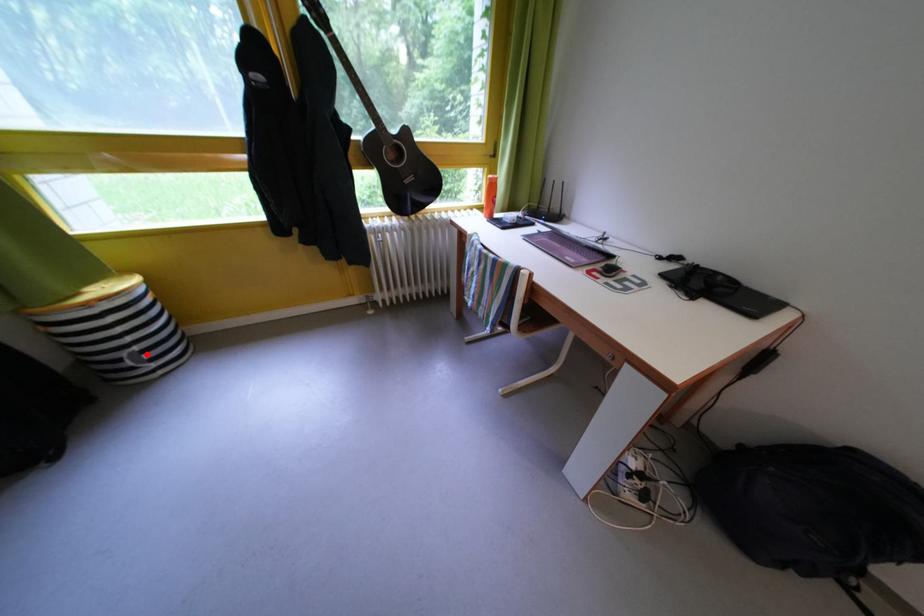
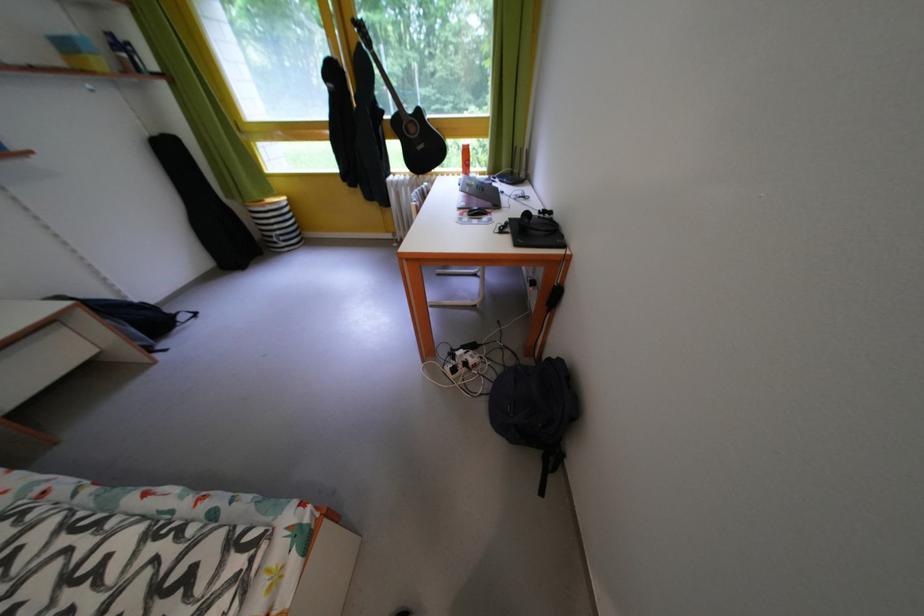
In the second image, find the point that corresponds to the highlighted location in the first image.

(287, 238)